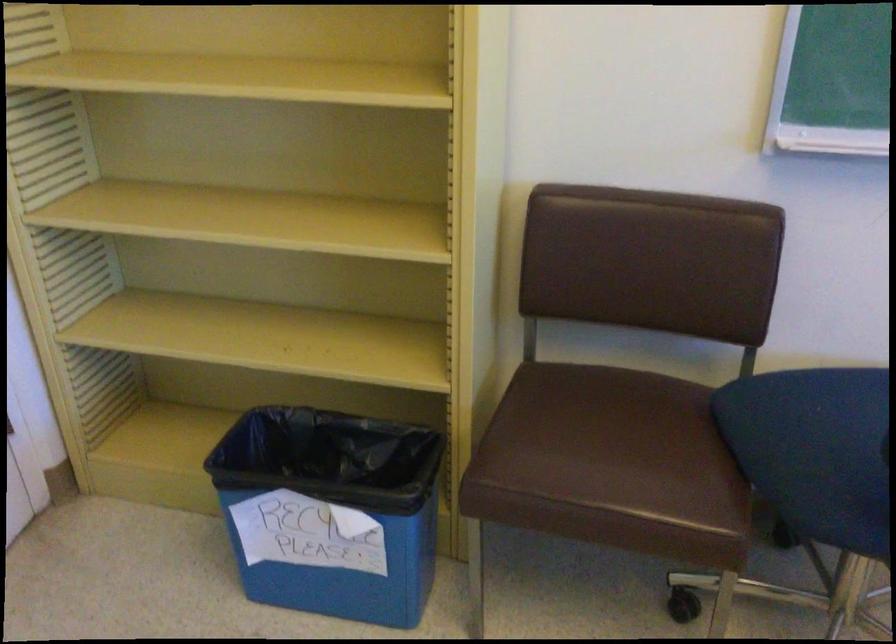
Find where to sit the brown chair sitting surface. Please return your answer as a coordinate pair (x, y).

(610, 464)